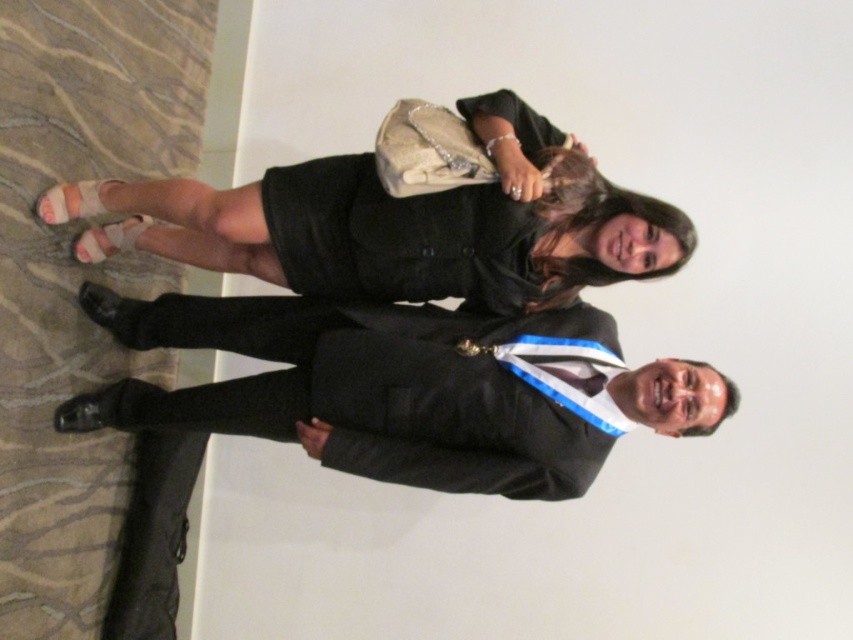
Question: Which object is farther from the camera taking this photo?

Choices:
 (A) black matte suit at center
 (B) black fabric dress at upper center

Answer: (A)

Question: Can you confirm if black fabric dress at upper center is positioned above black matte suit at center?

Choices:
 (A) yes
 (B) no

Answer: (A)

Question: Among these points, which one is nearest to the camera?

Choices:
 (A) (334, 180)
 (B) (438, 472)

Answer: (B)

Question: Does black fabric dress at upper center appear over black matte suit at center?

Choices:
 (A) no
 (B) yes

Answer: (B)

Question: Is black fabric dress at upper center bigger than black matte suit at center?

Choices:
 (A) yes
 (B) no

Answer: (A)